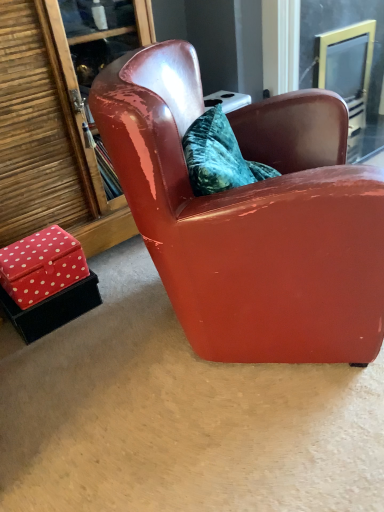
Question: Considering the positions of red velvet box at lower left, which is counted as the 2th box, starting from the bottom, and glossy leather armchair at center in the image, is red velvet box at lower left, which is counted as the 2th box, starting from the bottom, bigger or smaller than glossy leather armchair at center?

Choices:
 (A) small
 (B) big

Answer: (A)

Question: Relative to glossy leather armchair at center, is red velvet box at lower left, which is counted as the 2th box, starting from the bottom, in front or behind?

Choices:
 (A) behind
 (B) front

Answer: (A)

Question: Considering the real-world distances, which object is closest to the red polka dot fabric box at lower left, the 1th box ordered from the bottom?

Choices:
 (A) glossy leather armchair at center
 (B) clear glass screen door at upper right
 (C) red velvet box at lower left, which is the 1th box in top-to-bottom order

Answer: (C)

Question: Estimate the real-world distances between objects in this image. Which object is farther from the red velvet box at lower left, which is the 1th box in top-to-bottom order?

Choices:
 (A) glossy leather armchair at center
 (B) red polka dot fabric box at lower left, the 1th box ordered from the bottom
 (C) clear glass screen door at upper right

Answer: (C)